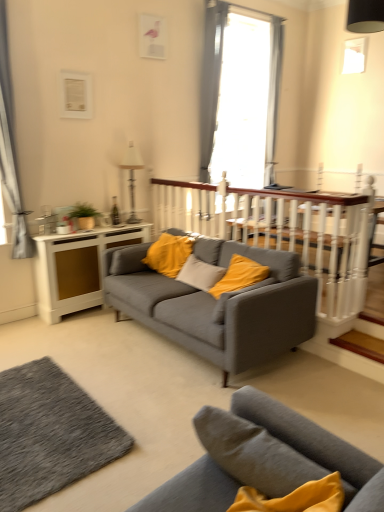
Question: From the image's perspective, is white wooden balustrade at center located above or below white wood side table at left?

Choices:
 (A) above
 (B) below

Answer: (A)

Question: Is white wooden balustrade at center wider or thinner than white wood side table at left?

Choices:
 (A) thin
 (B) wide

Answer: (A)

Question: Estimate the real-world distances between objects in this image. Which object is farther from the textured gray rug at lower left?

Choices:
 (A) matte gray couch at center, which is counted as the first studio couch, starting from the front
 (B) wooden at center
 (C) gray fabric curtain at left, the first curtain from the left
 (D) matte gray couch at center, which is the first studio couch from back to front
 (E) gray fabric curtain at upper center, placed as the second curtain when sorted from left to right

Answer: (E)

Question: Estimate the real-world distances between objects in this image. Which object is farther from the white wood side table at left?

Choices:
 (A) wooden at center
 (B) white wooden balustrade at center
 (C) metallic silver lamp at upper center
 (D) textured gray rug at lower left
 (E) matte gray couch at center, which is the first studio couch from back to front

Answer: (A)